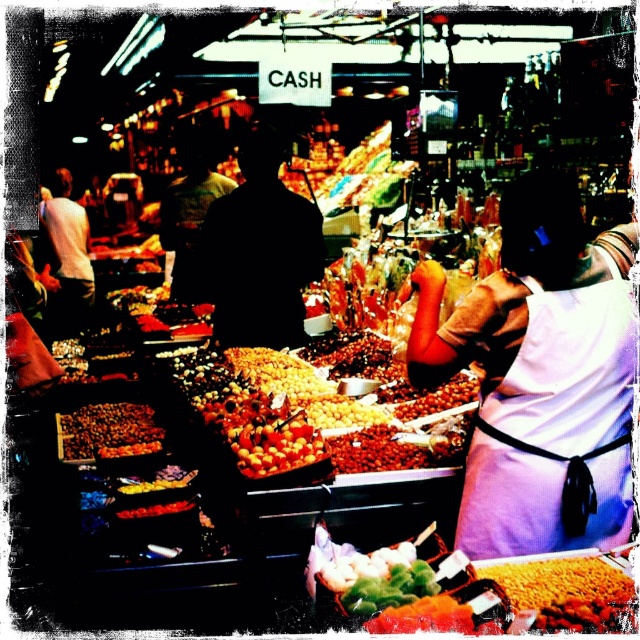
Which is above, silhouette figure at center or white shirt at left?

Positioned higher is silhouette figure at center.

The width and height of the screenshot is (640, 640). In order to click on silhouette figure at center in this screenshot , I will do `click(188, 211)`.

Is point (582, 358) farther from viewer compared to point (262, 451)?

No.

Who is positioned more to the right, purple fabric apron at right or shiny yellow fruit at center?

purple fabric apron at right

In order to click on purple fabric apron at right in this screenshot , I will do `click(556, 429)`.

Does point (556, 492) lie in front of point (276, 273)?

Yes, point (556, 492) is in front of point (276, 273).

Which is behind, point (612, 496) or point (273, 145)?

Positioned behind is point (273, 145).

What do you see at coordinates (556, 429) in the screenshot?
I see `purple fabric apron at right` at bounding box center [556, 429].

Image resolution: width=640 pixels, height=640 pixels. Find the location of `purple fabric apron at right`. purple fabric apron at right is located at coordinates (556, 429).